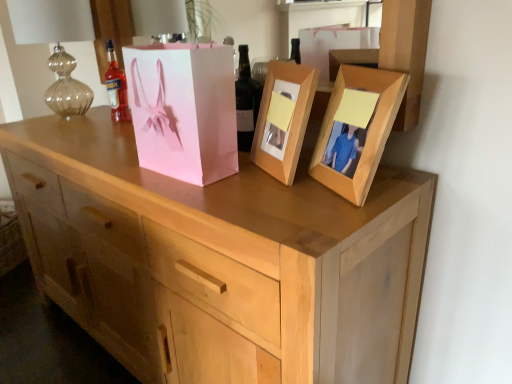
Identify the location of vacant area in front of pink paper bag at center. This screenshot has width=512, height=384. (207, 203).